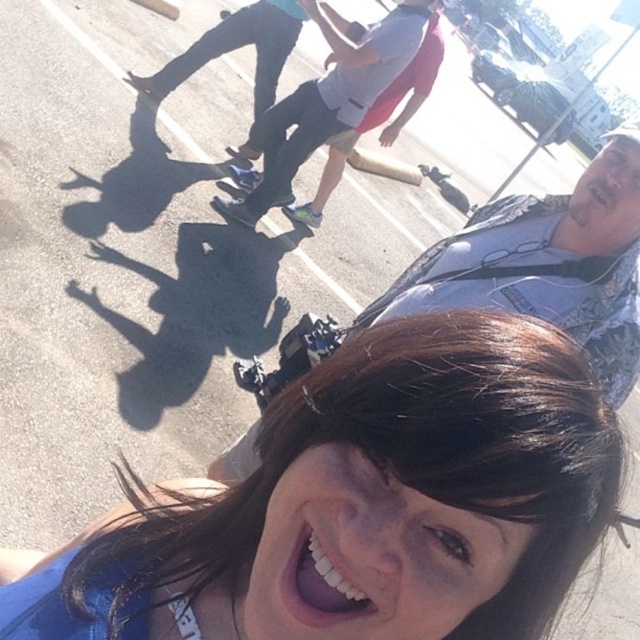
Between blue fabric at lower left and white glossy teeth at lower center, which one is positioned higher?

white glossy teeth at lower center

Is point (301, 444) positioned after point (348, 604)?

Yes.

The height and width of the screenshot is (640, 640). I want to click on blue fabric at lower left, so click(x=381, y=499).

Can you confirm if blue fabric at lower left is thinner than matte black skateboard at center?

No, blue fabric at lower left is not thinner than matte black skateboard at center.

Does blue fabric at lower left appear under matte black skateboard at center?

Correct, blue fabric at lower left is located below matte black skateboard at center.

Is point (529, 492) behind point (464, 269)?

No, it is not.

This screenshot has height=640, width=640. In order to click on blue fabric at lower left in this screenshot , I will do `click(381, 499)`.

Can you confirm if blue fabric at lower left is smaller than white matte skateboard at center?

Indeed, blue fabric at lower left has a smaller size compared to white matte skateboard at center.

Is point (460, 637) farther from camera compared to point (300, 141)?

No, it is in front of (300, 141).

The height and width of the screenshot is (640, 640). I want to click on blue fabric at lower left, so click(381, 499).